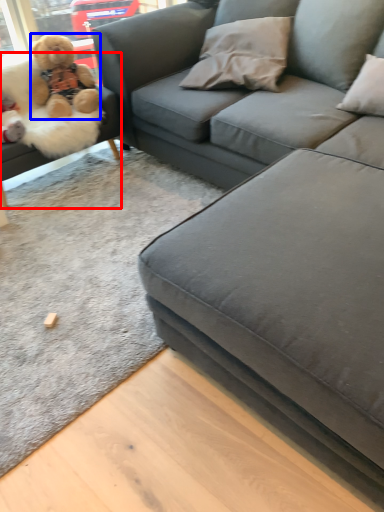
Question: Which of the following is the closest to the observer, studio couch (highlighted by a red box) or teddy bear (highlighted by a blue box)?

Choices:
 (A) studio couch
 (B) teddy bear

Answer: (A)